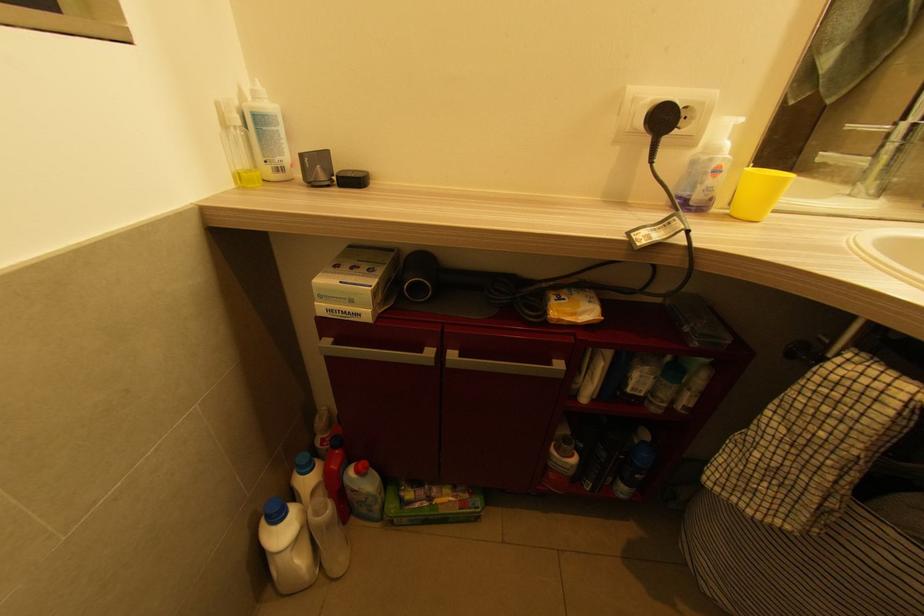
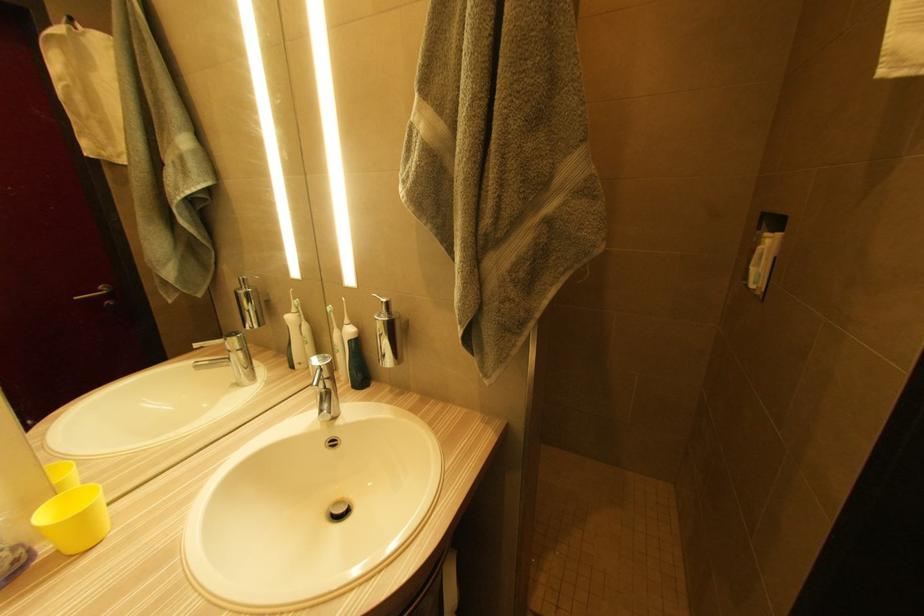
Question: How did the camera likely rotate?

Choices:
 (A) Left
 (B) Right
 (C) Up
 (D) Down

Answer: (B)